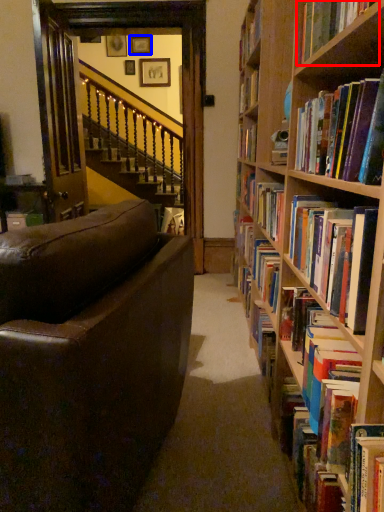
Question: Which object appears farthest to the camera in this image, book (highlighted by a red box) or picture frame (highlighted by a blue box)?

Choices:
 (A) book
 (B) picture frame

Answer: (B)